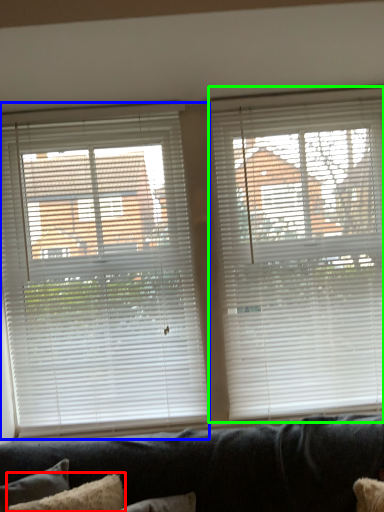
Question: Based on their relative distances, which object is nearer to pillow (highlighted by a red box)? Choose from window blind (highlighted by a blue box) and window blind (highlighted by a green box).

Choices:
 (A) window blind
 (B) window blind

Answer: (A)